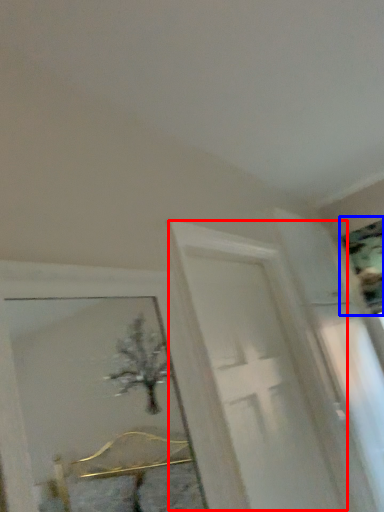
Question: Which of the following is the closest to the observer, screen door (highlighted by a red box) or picture frame (highlighted by a blue box)?

Choices:
 (A) screen door
 (B) picture frame

Answer: (A)